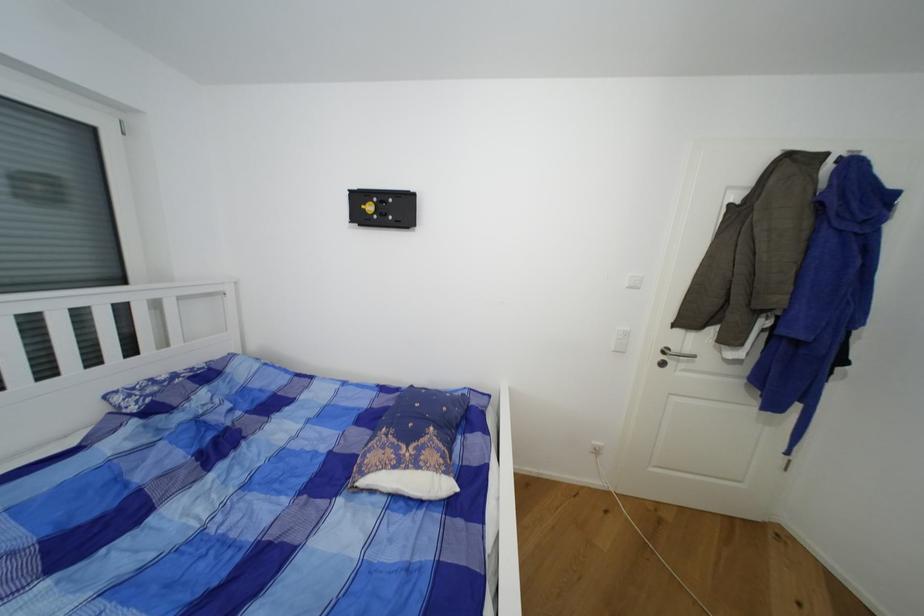
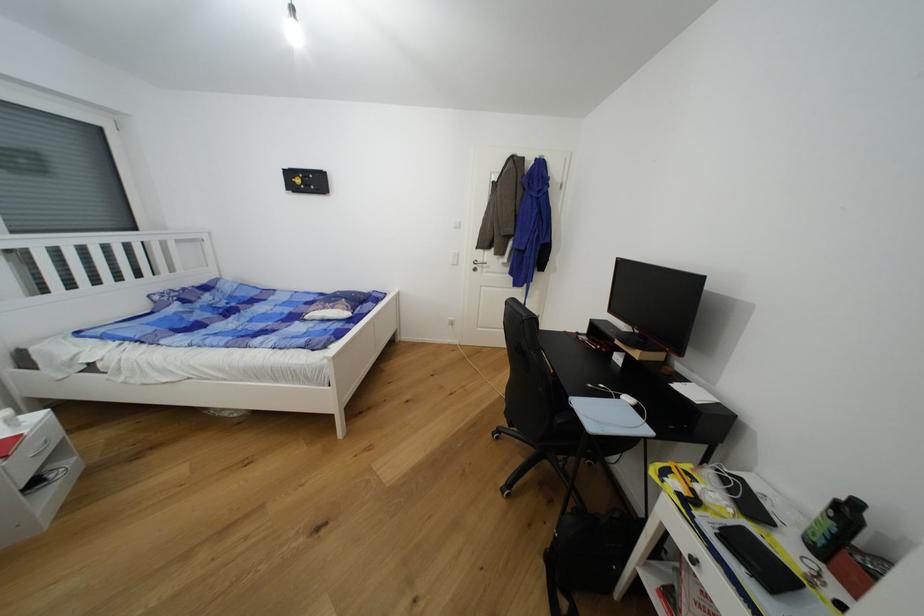
The point at (681, 351) is marked in the first image. Where is the corresponding point in the second image?

(484, 262)